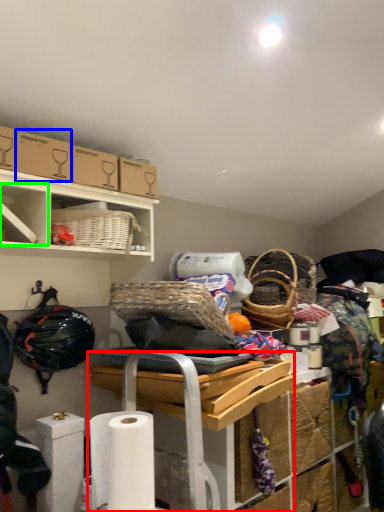
Question: Which object is positioned closest to table (highlighted by a red box)? Select from cardboard box (highlighted by a blue box) and cabinet (highlighted by a green box).

Choices:
 (A) cardboard box
 (B) cabinet

Answer: (B)